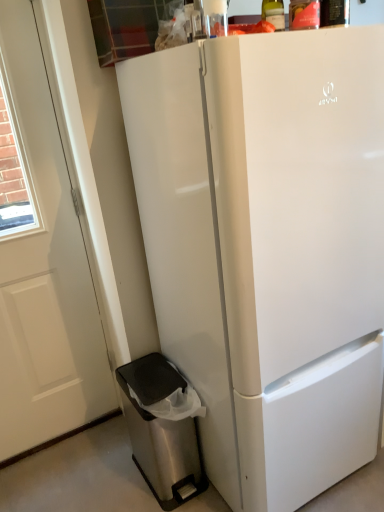
Identify the location of white matte door at left. The image size is (384, 512). (46, 263).

Locate an element on the screen. The image size is (384, 512). white glossy refrigerator at center is located at coordinates (268, 248).

Considering the relative sizes of white glossy refrigerator at center and translucent glass bottle at upper center in the image provided, is white glossy refrigerator at center bigger than translucent glass bottle at upper center?

Yes.

From the image's perspective, is white glossy refrigerator at center above or below translucent glass bottle at upper center?

Clearly, from the image's perspective, white glossy refrigerator at center is below translucent glass bottle at upper center.

Looking at their sizes, would you say white glossy refrigerator at center is wider or thinner than translucent glass bottle at upper center?

In the image, white glossy refrigerator at center appears to be wider than translucent glass bottle at upper center.

From a real-world perspective, between white glossy refrigerator at center and translucent glass bottle at upper center, who is vertically higher?

From a 3D spatial view, translucent glass bottle at upper center is above.

From a real-world perspective, who is located lower, white matte door at left or stainless steel trash can at lower left?

stainless steel trash can at lower left.

Does white matte door at left appear on the left side of stainless steel trash can at lower left?

Indeed, white matte door at left is positioned on the left side of stainless steel trash can at lower left.

Is white matte door at left shorter than stainless steel trash can at lower left?

No.

Is stainless steel trash can at lower left at the back of translucent glass bottle at upper center?

translucent glass bottle at upper center does not have its back to stainless steel trash can at lower left.

From the image's perspective, would you say translucent glass bottle at upper center is positioned over stainless steel trash can at lower left?

Yes.

Which of these two, translucent glass bottle at upper center or stainless steel trash can at lower left, is thinner?

With smaller width is translucent glass bottle at upper center.

Where is `dish washer behind the translucent glass bottle at upper center`? This screenshot has height=512, width=384. dish washer behind the translucent glass bottle at upper center is located at coordinates [x=161, y=429].

How much distance is there between white glossy refrigerator at center and stainless steel trash can at lower left?

A distance of 19.55 inches exists between white glossy refrigerator at center and stainless steel trash can at lower left.

Which of these two, white glossy refrigerator at center or stainless steel trash can at lower left, is thinner?

With smaller width is stainless steel trash can at lower left.

Does point (380, 76) appear closer or farther from the camera than point (177, 474)?

Point (380, 76) is positioned closer to the camera compared to point (177, 474).

Is white glossy refrigerator at center in contact with stainless steel trash can at lower left?

white glossy refrigerator at center is not next to stainless steel trash can at lower left, and they're not touching.

Identify the location of bottle on the right side of stainless steel trash can at lower left. The image size is (384, 512). (274, 13).

Does stainless steel trash can at lower left appear on the left side of translucent glass bottle at upper center?

Yes, stainless steel trash can at lower left is to the left of translucent glass bottle at upper center.

Which object is wider, stainless steel trash can at lower left or translucent glass bottle at upper center?

Wider between the two is stainless steel trash can at lower left.

Considering the relative sizes of translucent glass bottle at upper center and white matte door at left in the image provided, is translucent glass bottle at upper center thinner than white matte door at left?

Indeed, translucent glass bottle at upper center has a lesser width compared to white matte door at left.

Can you confirm if translucent glass bottle at upper center is smaller than white matte door at left?

Indeed, translucent glass bottle at upper center has a smaller size compared to white matte door at left.

How far apart are translucent glass bottle at upper center and white matte door at left?

They are 4.11 feet apart.

Is translucent glass bottle at upper center taller than white matte door at left?

No, translucent glass bottle at upper center is not taller than white matte door at left.

From a real-world perspective, between translucent glass bottle at upper center and white glossy refrigerator at center, who is vertically higher?

translucent glass bottle at upper center is physically above.

Is translucent glass bottle at upper center inside the boundaries of white glossy refrigerator at center, or outside?

translucent glass bottle at upper center exists outside the volume of white glossy refrigerator at center.

Is point (283, 4) closer or farther from the camera than point (242, 412)?

Clearly, point (283, 4) is closer to the camera than point (242, 412).

Is translucent glass bottle at upper center closer to camera compared to white glossy refrigerator at center?

No, it is not.

Locate an element on the screen. bottle that is on the left side of white glossy refrigerator at center is located at coordinates (274, 13).

Locate an element on the screen. This screenshot has width=384, height=512. screen door lying above the stainless steel trash can at lower left (from the image's perspective) is located at coordinates (46, 263).

Looking at the image, which one is located further to white glossy refrigerator at center, white matte door at left or stainless steel trash can at lower left?

Among the two, white matte door at left is located further to white glossy refrigerator at center.

Looking at the image, which one is located further to white glossy refrigerator at center, stainless steel trash can at lower left or white matte door at left?

Based on the image, white matte door at left appears to be further to white glossy refrigerator at center.

Which object lies nearer to the anchor point white matte door at left, translucent glass bottle at upper center or white glossy refrigerator at center?

white glossy refrigerator at center is positioned closer to the anchor white matte door at left.

In the scene shown: Estimate the real-world distances between objects in this image. Which object is closer to stainless steel trash can at lower left, white matte door at left or translucent glass bottle at upper center?

Among the two, white matte door at left is located nearer to stainless steel trash can at lower left.

Considering their positions, is translucent glass bottle at upper center positioned further to white matte door at left than stainless steel trash can at lower left?

translucent glass bottle at upper center.

Looking at the image, which one is located further to stainless steel trash can at lower left, white glossy refrigerator at center or translucent glass bottle at upper center?

Based on the image, translucent glass bottle at upper center appears to be further to stainless steel trash can at lower left.

Looking at the image, which one is located further to translucent glass bottle at upper center, white glossy refrigerator at center or stainless steel trash can at lower left?

Based on the image, stainless steel trash can at lower left appears to be further to translucent glass bottle at upper center.

Based on their spatial positions, is white glossy refrigerator at center or translucent glass bottle at upper center closer to white matte door at left?

white glossy refrigerator at center is closer to white matte door at left.

In order to click on screen door between translucent glass bottle at upper center and stainless steel trash can at lower left vertically in this screenshot , I will do `click(46, 263)`.

Find the location of a particular element. refrigerator between translucent glass bottle at upper center and stainless steel trash can at lower left in the vertical direction is located at coordinates (268, 248).

What are the coordinates of `dish washer situated between white matte door at left and white glossy refrigerator at center from left to right` in the screenshot? It's located at (161, 429).

What are the coordinates of `bottle between white matte door at left and white glossy refrigerator at center in the horizontal direction` in the screenshot? It's located at (274, 13).